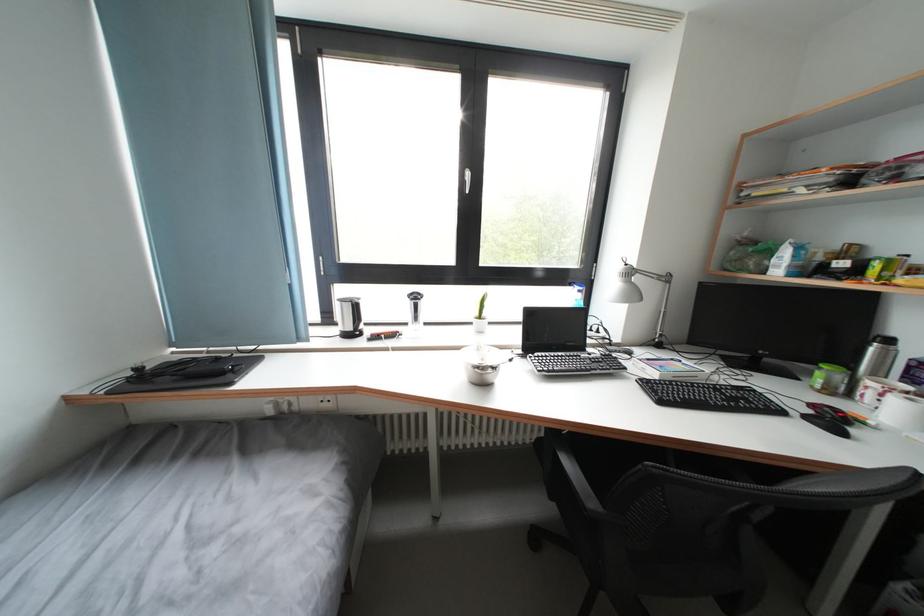
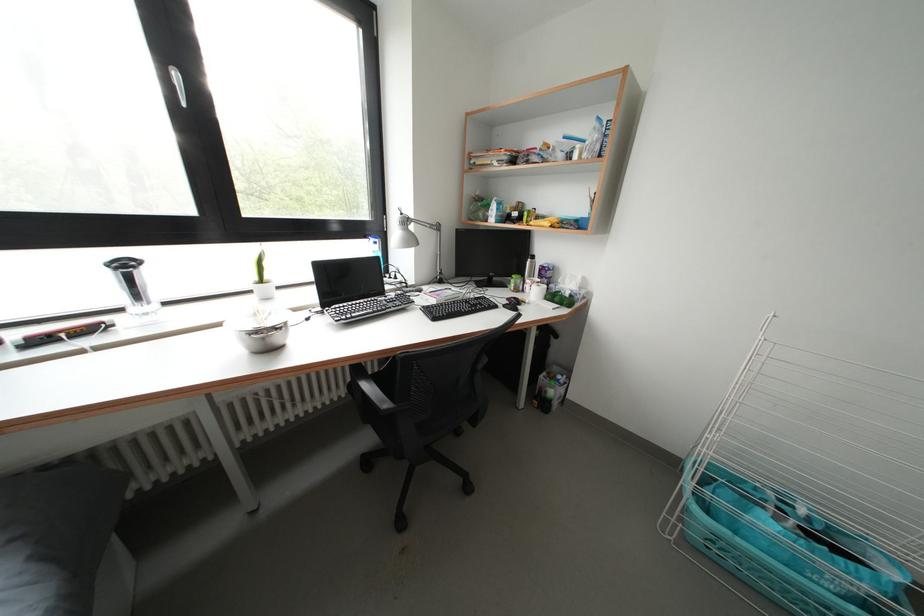
In the second image, find the point that corresponds to point (877, 389) in the first image.

(535, 286)